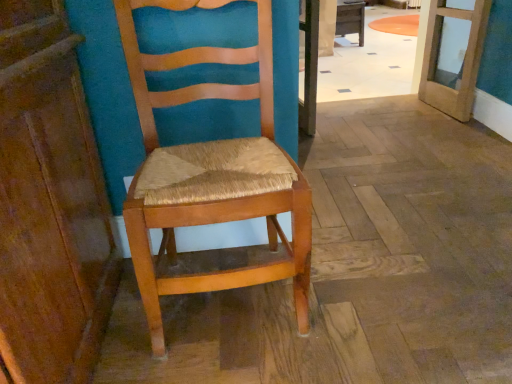
What is the approximate width of wooden table at center?

31.77 inches.

At what (x,y) coordinates should I click in order to perform the action: click on wooden woven seat at center. Please return your answer as a coordinate pair (x, y). This screenshot has height=384, width=512. Looking at the image, I should click on (212, 178).

Locate an element on the screen. This screenshot has height=384, width=512. wooden table at center is located at coordinates (351, 18).

Does wooden door at upper right have a greater width compared to wooden table at center?

No.

Can you confirm if wooden door at upper right is shorter than wooden table at center?

In fact, wooden door at upper right may be taller than wooden table at center.

Which point is more forward, (424, 81) or (364, 13)?

Point (424, 81)

From the image's perspective, is wooden door at upper right located above wooden table at center?

Actually, wooden door at upper right appears below wooden table at center in the image.

From a real-world perspective, which object stands above the other?

wooden woven seat at center is physically above.

Is wooden woven seat at center oriented away from wooden door at upper right?

That's not correct — wooden woven seat at center is not looking away from wooden door at upper right.

Is wooden woven seat at center beside wooden door at upper right?

No, wooden woven seat at center is not touching wooden door at upper right.

Does wooden woven seat at center have a lesser width compared to wooden door at upper right?

Incorrect, the width of wooden woven seat at center is not less than that of wooden door at upper right.

Which object is positioned more to the right, wooden table at center or wooden door at upper right?

From the viewer's perspective, wooden table at center appears more on the right side.

Can you confirm if wooden table at center is taller than wooden door at upper right?

No, wooden table at center is not taller than wooden door at upper right.

Does wooden table at center turn towards wooden door at upper right?

Yes, wooden table at center faces towards wooden door at upper right.

Is wooden table at center inside the boundaries of wooden door at upper right, or outside?

wooden table at center is not enclosed by wooden door at upper right.

From the image's perspective, is wooden door at upper right located above or below wooden woven seat at center?

wooden door at upper right is situated higher than wooden woven seat at center in the image.

Is wooden door at upper right to the left of wooden woven seat at center from the viewer's perspective?

No.

Can you confirm if wooden door at upper right is thinner than wooden woven seat at center?

Yes.

Where is `table lying above the wooden woven seat at center (from the image's perspective)`? This screenshot has height=384, width=512. table lying above the wooden woven seat at center (from the image's perspective) is located at coordinates (351, 18).

Which object is thinner, wooden table at center or wooden woven seat at center?

Thinner between the two is wooden woven seat at center.

From the image's perspective, does wooden table at center appear lower than wooden woven seat at center?

No, from the image's perspective, wooden table at center is not beneath wooden woven seat at center.

Looking at this image, is wooden woven seat at center directly adjacent to wooden table at center?

No, wooden woven seat at center is not touching wooden table at center.

Is wooden table at center a part of wooden woven seat at center?

A: No.

Is wooden woven seat at center further to camera compared to wooden table at center?

No, wooden woven seat at center is closer to the viewer.

Is wooden woven seat at center looking in the opposite direction of wooden table at center?

No, wooden woven seat at center is not facing away from wooden table at center.

This screenshot has height=384, width=512. I want to click on table on the right side of wooden door at upper right, so point(351,18).

Where is `chair below the wooden door at upper right (from the image's perspective)`? This screenshot has width=512, height=384. chair below the wooden door at upper right (from the image's perspective) is located at coordinates (212, 178).

Estimate the real-world distances between objects in this image. Which object is closer to wooden table at center, wooden door at upper right or wooden woven seat at center?

Based on the image, wooden door at upper right appears to be nearer to wooden table at center.

From the image, which object appears to be nearer to wooden door at upper right, wooden table at center or wooden woven seat at center?

wooden table at center lies closer to wooden door at upper right than the other object.

Considering their positions, is wooden woven seat at center positioned closer to wooden table at center than wooden door at upper right?

Result: wooden door at upper right is positioned closer to the anchor wooden table at center.

From the image, which object appears to be nearer to wooden woven seat at center, wooden door at upper right or wooden table at center?

Based on the image, wooden door at upper right appears to be nearer to wooden woven seat at center.

Looking at the image, which one is located closer to wooden woven seat at center, wooden table at center or wooden door at upper right?

wooden door at upper right is closer to wooden woven seat at center.

Considering their positions, is wooden woven seat at center positioned further to wooden door at upper right than wooden table at center?

wooden woven seat at center is positioned further to the anchor wooden door at upper right.

Where is `door between wooden woven seat at center and wooden table at center in the front-back direction`? This screenshot has height=384, width=512. door between wooden woven seat at center and wooden table at center in the front-back direction is located at coordinates coord(463,58).